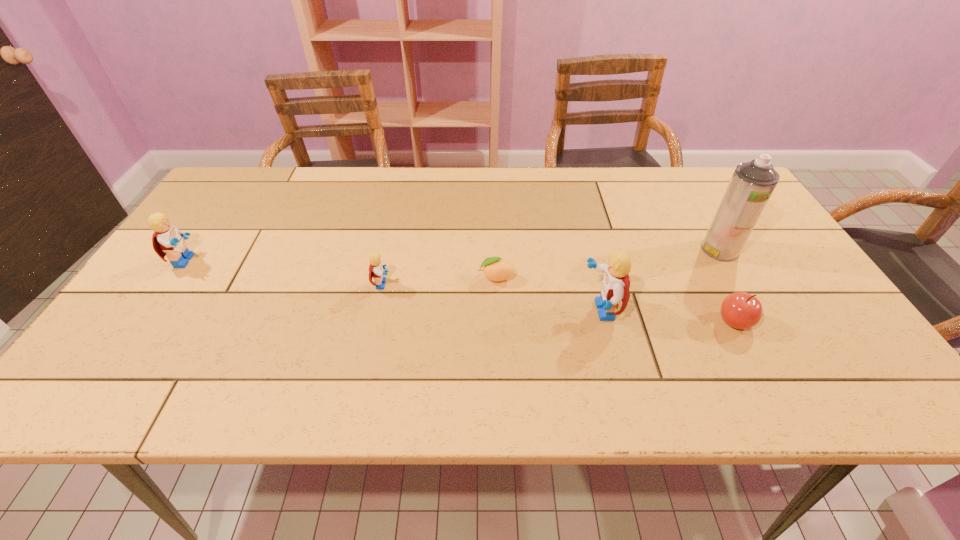
You are a GUI agent. You are given a task and a screenshot of the screen. Output one action in this format:
    pyautogui.click(x=<x>, y=<y>)
    Task: Click on the free space located on the front-facing side of the third tallest object
    The image size is (960, 540).
    Given the screenshot: What is the action you would take?
    pyautogui.click(x=344, y=261)

This screenshot has width=960, height=540. In order to click on vacant space situated on the front-facing side of the second object from left to right in this screenshot , I will do `click(527, 284)`.

Image resolution: width=960 pixels, height=540 pixels. Find the location of `blank space located on the front-facing side of the third object from right to left`. blank space located on the front-facing side of the third object from right to left is located at coordinates (496, 310).

I want to click on free region located on the front-facing side of the third object from right to left, so tap(561, 310).

Identify the location of free space located 0.140m on the front-facing side of the third object from right to left. (522, 310).

Locate an element on the screen. free point located on the front of the tallest object is located at coordinates (745, 293).

What are the coordinates of `vacant space located 0.090m with leaves positioned above the shortest object` in the screenshot? It's located at (442, 277).

Locate an element on the screen. This screenshot has width=960, height=540. free space located with leaves positioned above the shortest object is located at coordinates (429, 277).

In order to click on vacant space situated 0.230m with leaves positioned above the shortest object in this screenshot , I will do `click(386, 277)`.

Find the location of `vacant region located 0.290m on the back of the apple`. vacant region located 0.290m on the back of the apple is located at coordinates (686, 230).